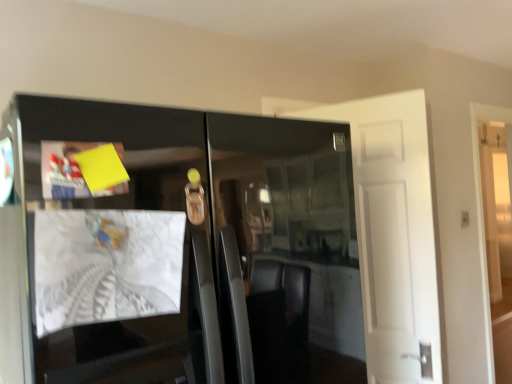
Question: Can you confirm if white paper at left, arranged as the 1th magazine when ordered from the bottom, is wider than glossy black cabinet at center?

Choices:
 (A) yes
 (B) no

Answer: (B)

Question: Considering the relative sizes of white paper at left, placed as the second magazine when sorted from top to bottom, and glossy black cabinet at center in the image provided, is white paper at left, placed as the second magazine when sorted from top to bottom, shorter than glossy black cabinet at center?

Choices:
 (A) yes
 (B) no

Answer: (A)

Question: Is white paper at left, arranged as the 1th magazine when ordered from the bottom, behind glossy black cabinet at center?

Choices:
 (A) yes
 (B) no

Answer: (A)

Question: From the image's perspective, is white paper at left, arranged as the 1th magazine when ordered from the bottom, above glossy black cabinet at center?

Choices:
 (A) no
 (B) yes

Answer: (B)

Question: Could you tell me if white paper at left, arranged as the 1th magazine when ordered from the bottom, is facing glossy black cabinet at center?

Choices:
 (A) no
 (B) yes

Answer: (B)

Question: Does white paper at left, arranged as the 1th magazine when ordered from the bottom, appear on the right side of glossy black cabinet at center?

Choices:
 (A) no
 (B) yes

Answer: (A)

Question: From a real-world perspective, is yellow paper at upper left, the 2th magazine positioned from the bottom, below white paper at left, arranged as the 1th magazine when ordered from the bottom?

Choices:
 (A) yes
 (B) no

Answer: (B)

Question: From the image's perspective, does yellow paper at upper left, the 2th magazine positioned from the bottom, appear lower than white paper at left, arranged as the 1th magazine when ordered from the bottom?

Choices:
 (A) yes
 (B) no

Answer: (B)

Question: Considering the relative sizes of yellow paper at upper left, the first magazine from the top, and white paper at left, arranged as the 1th magazine when ordered from the bottom, in the image provided, is yellow paper at upper left, the first magazine from the top, wider than white paper at left, arranged as the 1th magazine when ordered from the bottom,?

Choices:
 (A) yes
 (B) no

Answer: (B)

Question: Does yellow paper at upper left, the 2th magazine positioned from the bottom, have a larger size compared to white paper at left, placed as the second magazine when sorted from top to bottom?

Choices:
 (A) yes
 (B) no

Answer: (B)

Question: Is there a large distance between yellow paper at upper left, the first magazine from the top, and white paper at left, placed as the second magazine when sorted from top to bottom?

Choices:
 (A) yes
 (B) no

Answer: (B)

Question: Is yellow paper at upper left, the 2th magazine positioned from the bottom, positioned with its back to white paper at left, arranged as the 1th magazine when ordered from the bottom?

Choices:
 (A) yes
 (B) no

Answer: (B)

Question: From a real-world perspective, is glossy black cabinet at center over yellow paper at upper left, the 2th magazine positioned from the bottom?

Choices:
 (A) yes
 (B) no

Answer: (B)